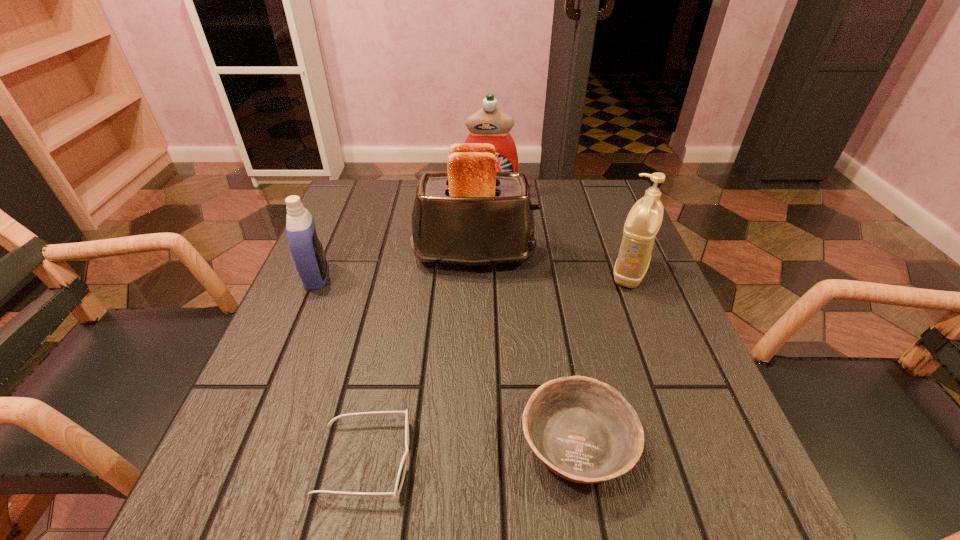
At what (x,y) coordinates should I click in order to perform the action: click on free spot located 0.250m on the front of the leftmost object. Please return your answer as a coordinate pair (x, y). This screenshot has width=960, height=540. Looking at the image, I should click on (267, 392).

Where is `free space located 0.080m on the back of the bowl`? free space located 0.080m on the back of the bowl is located at coordinates (562, 359).

Find the location of `vacant point located 0.290m with the lenses of the shortest object facing outward`. vacant point located 0.290m with the lenses of the shortest object facing outward is located at coordinates (603, 460).

Identify the location of object at the far edge. (491, 125).

Locate an element on the screen. This screenshot has width=960, height=540. bowl that is at the near edge is located at coordinates (583, 430).

The image size is (960, 540). Identify the location of sunglasses that is at the near edge. (402, 469).

This screenshot has width=960, height=540. What are the coordinates of `detergent present at the left edge` in the screenshot? It's located at (306, 248).

The image size is (960, 540). I want to click on sunglasses that is positioned at the left edge, so click(402, 469).

Where is `detergent that is at the right edge`? The height and width of the screenshot is (540, 960). detergent that is at the right edge is located at coordinates (644, 220).

Where is `bowl present at the right edge`? bowl present at the right edge is located at coordinates (583, 430).